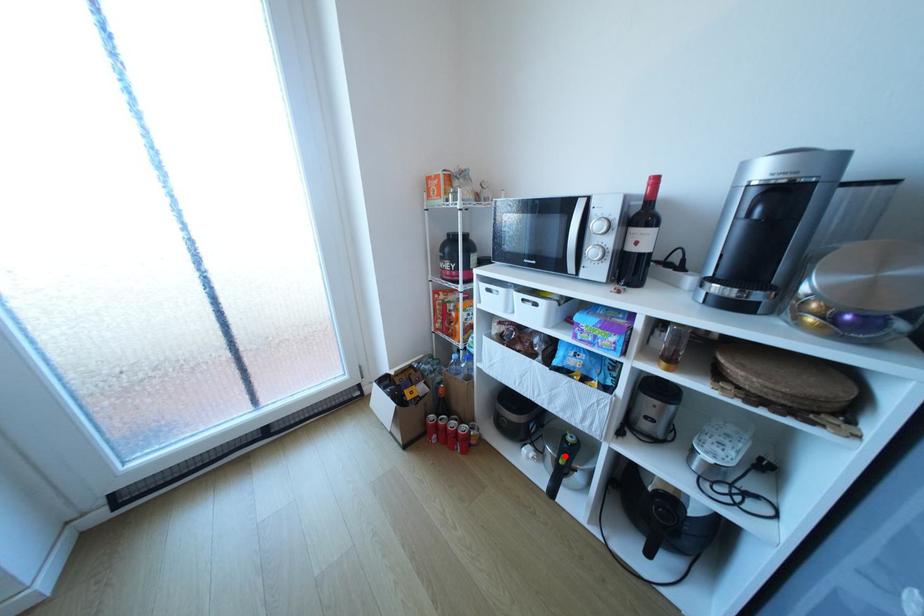
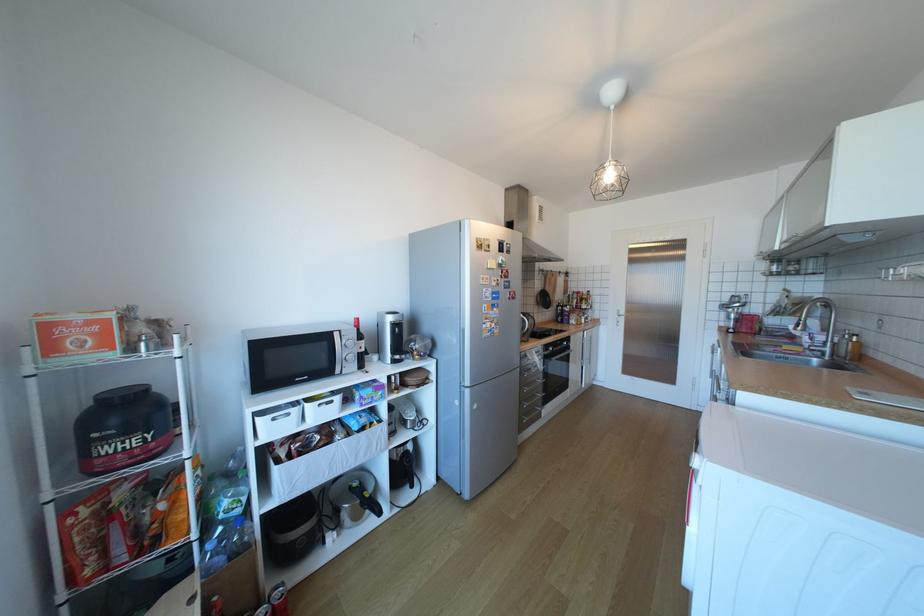
Locate, in the second image, the point that corresponds to the highlighted location in the first image.

(369, 501)